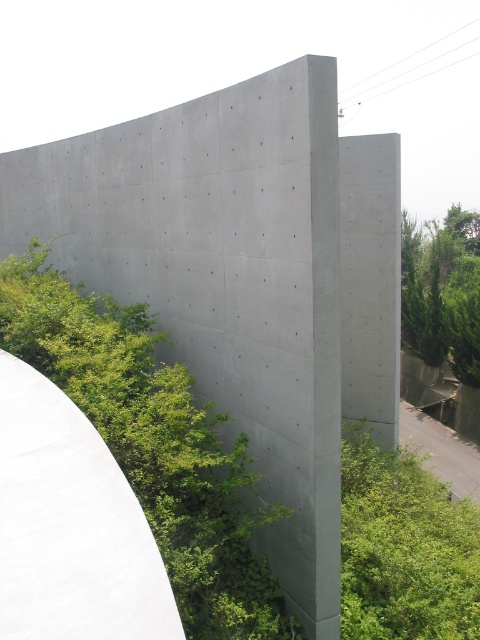
Does green leafy shrub at center-left have a greater width compared to gray concrete wall at center?

Indeed, green leafy shrub at center-left has a greater width compared to gray concrete wall at center.

I want to click on green leafy shrub at center-left, so click(153, 444).

Is point (96, 451) more distant than point (345, 448)?

No, it is not.

Does gray concrete wall at center have a larger size compared to green leafy bush at lower right?

Incorrect, gray concrete wall at center is not larger than green leafy bush at lower right.

The width and height of the screenshot is (480, 640). What are the coordinates of `gray concrete wall at center` in the screenshot? It's located at (71, 525).

Can you confirm if green leafy shrub at center-left is bigger than green leafy bush at lower right?

Yes, green leafy shrub at center-left is bigger than green leafy bush at lower right.

Is point (101, 300) in front of point (458, 600)?

No, (101, 300) is further to viewer.

Find the location of a particular element. The width and height of the screenshot is (480, 640). green leafy shrub at center-left is located at coordinates (153, 444).